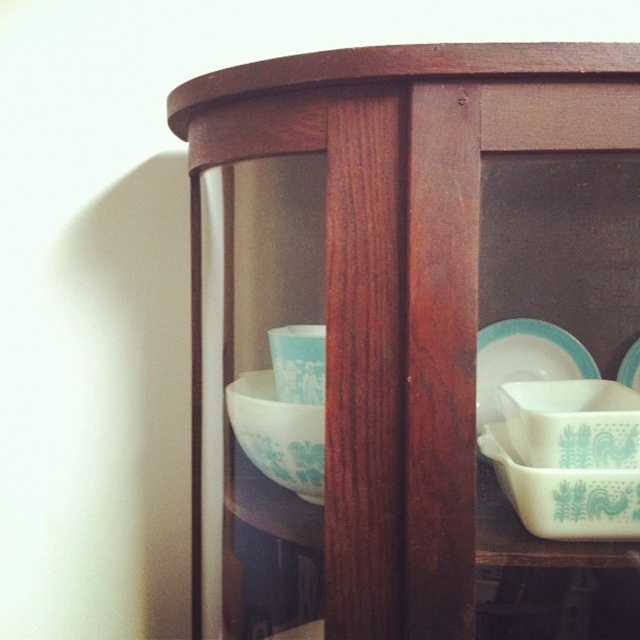
Question: Can you confirm if white glossy casserole dish at lower right is positioned to the right of teal glossy bowl at center?

Choices:
 (A) no
 (B) yes

Answer: (B)

Question: Does white glossy bowl at center appear over teal ceramic plate at center?

Choices:
 (A) yes
 (B) no

Answer: (B)

Question: Can you confirm if wooden cabinet at center is thinner than white glossy plate at center?

Choices:
 (A) yes
 (B) no

Answer: (B)

Question: Estimate the real-world distances between objects in this image. Which object is farther from the white glossy plate at center?

Choices:
 (A) teal glossy bowl at center
 (B) wooden cabinet at center
 (C) white glossy casserole dish at lower right
 (D) teal ceramic plate at center

Answer: (A)

Question: Which point is farther to the camera?

Choices:
 (A) white glossy casserole dish at right
 (B) white glossy casserole dish at lower right
 (C) white glossy bowl at center

Answer: (C)

Question: Considering the real-world distances, which object is farthest from the white glossy casserole dish at lower right?

Choices:
 (A) teal ceramic plate at center
 (B) white glossy plate at center
 (C) wooden cabinet at center
 (D) white glossy bowl at center

Answer: (A)